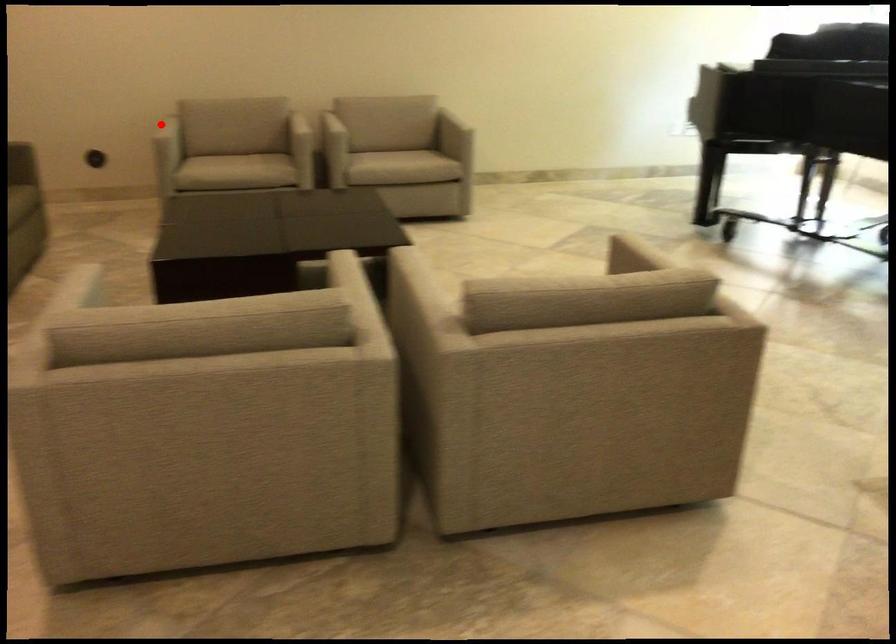
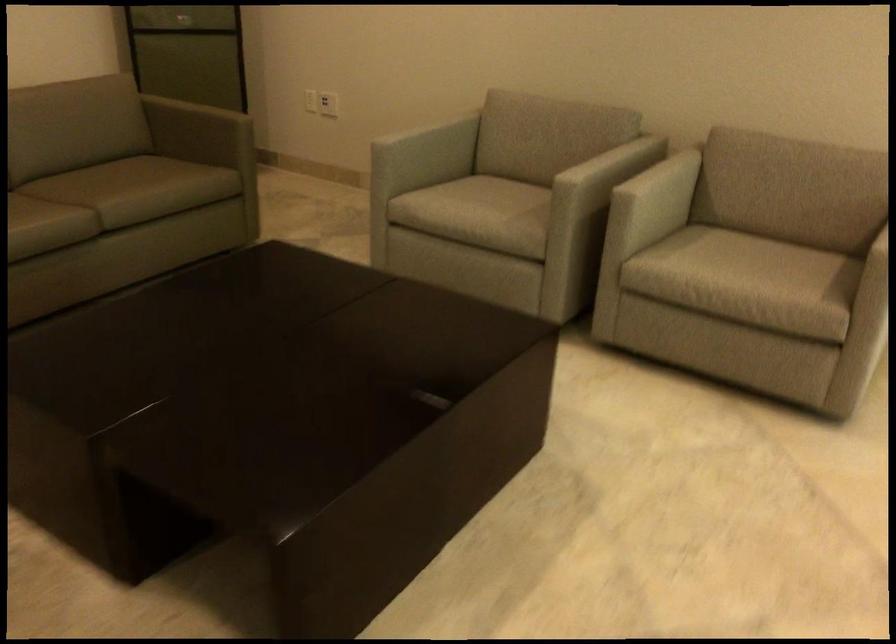
Where in the second image is the point corresponding to the highlighted location from the first image?

(423, 127)